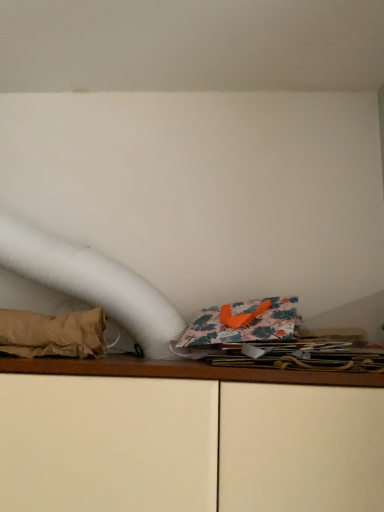
Question: Should I look upward or downward to see matte wooden cabinet at center?

Choices:
 (A) up
 (B) down

Answer: (B)

Question: Is matte wooden cabinet at center taller than brown fabric at left?

Choices:
 (A) no
 (B) yes

Answer: (B)

Question: Is matte wooden cabinet at center completely or partially outside of brown fabric at left?

Choices:
 (A) no
 (B) yes

Answer: (B)

Question: Does matte wooden cabinet at center have a lesser height compared to brown fabric at left?

Choices:
 (A) no
 (B) yes

Answer: (A)

Question: Does matte wooden cabinet at center appear on the left side of brown fabric at left?

Choices:
 (A) no
 (B) yes

Answer: (A)

Question: Is matte wooden cabinet at center oriented away from brown fabric at left?

Choices:
 (A) no
 (B) yes

Answer: (A)

Question: Is brown fabric at left located within matte wooden cabinet at center?

Choices:
 (A) no
 (B) yes

Answer: (A)

Question: From a real-world perspective, is brown fabric at left on matte wooden cabinet at center?

Choices:
 (A) yes
 (B) no

Answer: (A)

Question: Is matte wooden cabinet at center completely or partially inside brown fabric at left?

Choices:
 (A) yes
 (B) no

Answer: (B)

Question: Does brown fabric at left have a larger size compared to matte wooden cabinet at center?

Choices:
 (A) no
 (B) yes

Answer: (A)

Question: Is brown fabric at left outside matte wooden cabinet at center?

Choices:
 (A) yes
 (B) no

Answer: (A)

Question: Would you consider brown fabric at left to be distant from matte wooden cabinet at center?

Choices:
 (A) yes
 (B) no

Answer: (B)

Question: Is brown fabric at left thinner than matte wooden cabinet at center?

Choices:
 (A) no
 (B) yes

Answer: (B)

Question: From the image's perspective, is matte wooden cabinet at center located above or below brown fabric at left?

Choices:
 (A) below
 (B) above

Answer: (A)